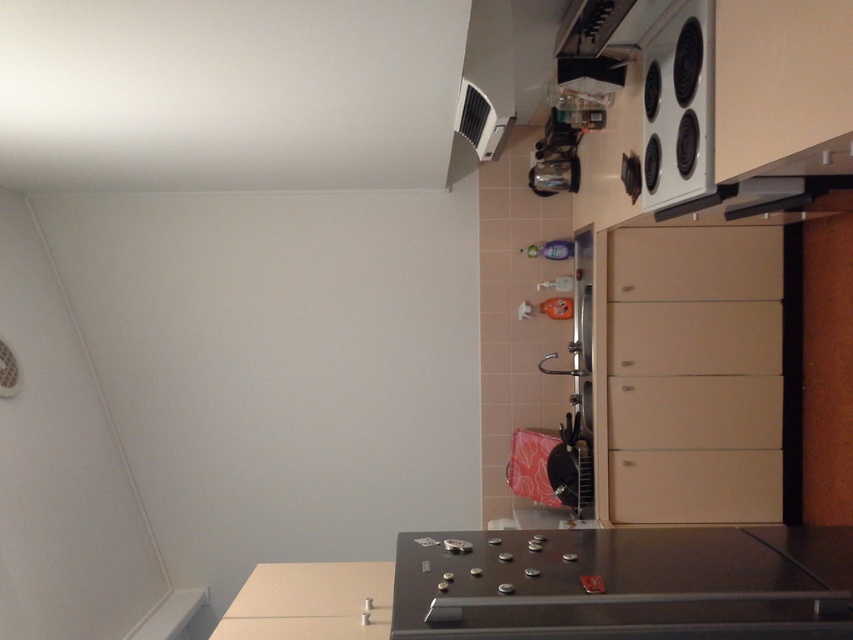
Question: From the image, what is the correct spatial relationship of black matte countertop at lower center in relation to white glossy electric stove at upper right?

Choices:
 (A) below
 (B) above

Answer: (A)

Question: Which point is farther from the camera taking this photo?

Choices:
 (A) (709, 193)
 (B) (258, 572)

Answer: (B)

Question: Among these points, which one is farthest from the camera?

Choices:
 (A) (669, 170)
 (B) (403, 621)

Answer: (A)

Question: Which point appears closest to the camera in this image?

Choices:
 (A) (711, 26)
 (B) (268, 598)

Answer: (A)

Question: Does black matte countertop at lower center appear over white glossy electric stove at upper right?

Choices:
 (A) no
 (B) yes

Answer: (A)

Question: Does black matte countertop at lower center appear under white glossy electric stove at upper right?

Choices:
 (A) no
 (B) yes

Answer: (B)